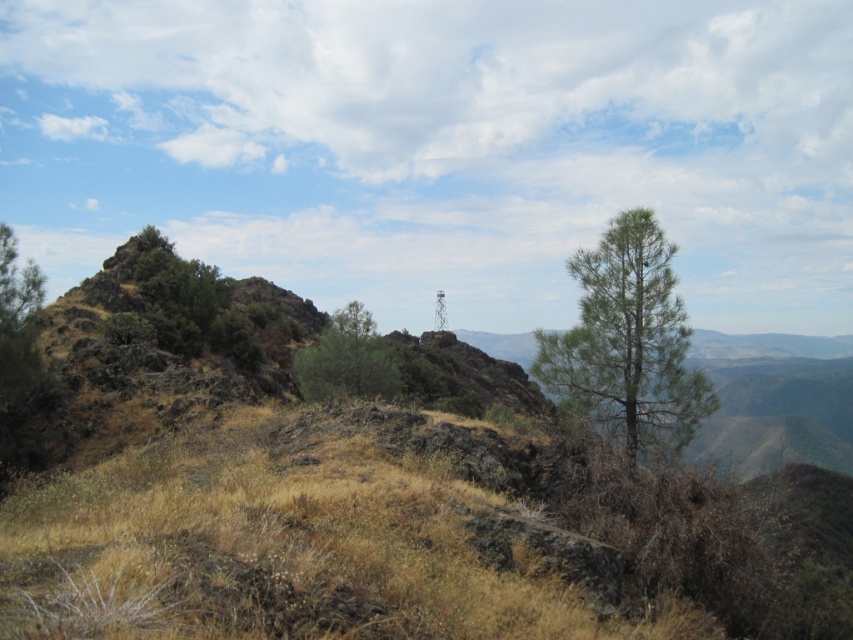
Question: Where is green matte tree at center located in relation to green leafy tree at center in the image?

Choices:
 (A) above
 (B) below

Answer: (B)

Question: From the image, what is the correct spatial relationship of green matte tree at center in relation to green rough rock at upper left?

Choices:
 (A) below
 (B) above

Answer: (A)

Question: Based on their relative distances, which object is nearer to the green matte tree at center?

Choices:
 (A) green rough rock at upper left
 (B) green leafy tree at center

Answer: (B)

Question: From the image, what is the correct spatial relationship of green matte tree at center in relation to green leafy tree at center?

Choices:
 (A) above
 (B) below

Answer: (B)

Question: Which point is closer to the camera?

Choices:
 (A) green matte tree at center
 (B) green leafy tree at center
 (C) green rough rock at upper left

Answer: (A)

Question: Which point is closer to the camera?

Choices:
 (A) (610, 400)
 (B) (198, 333)
 (C) (305, 381)

Answer: (A)